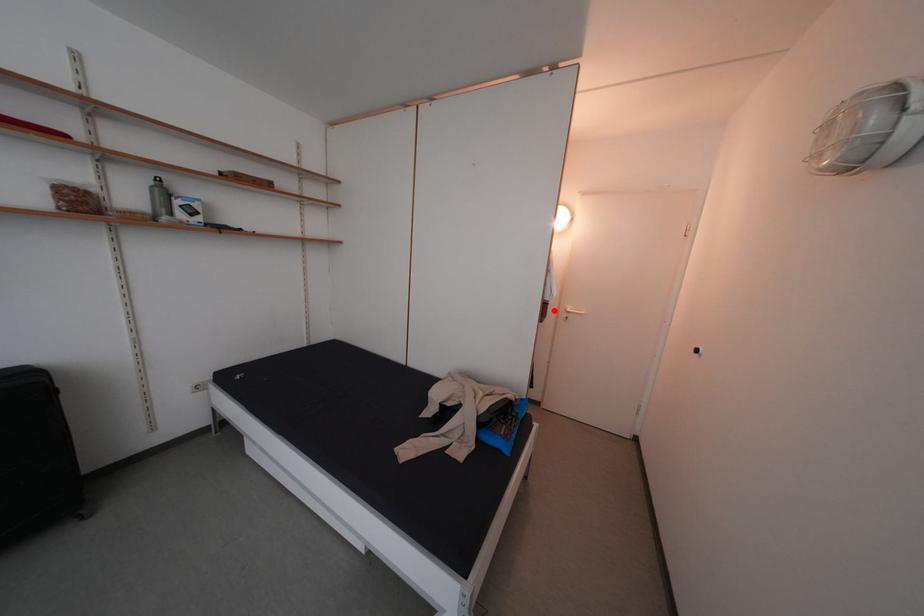
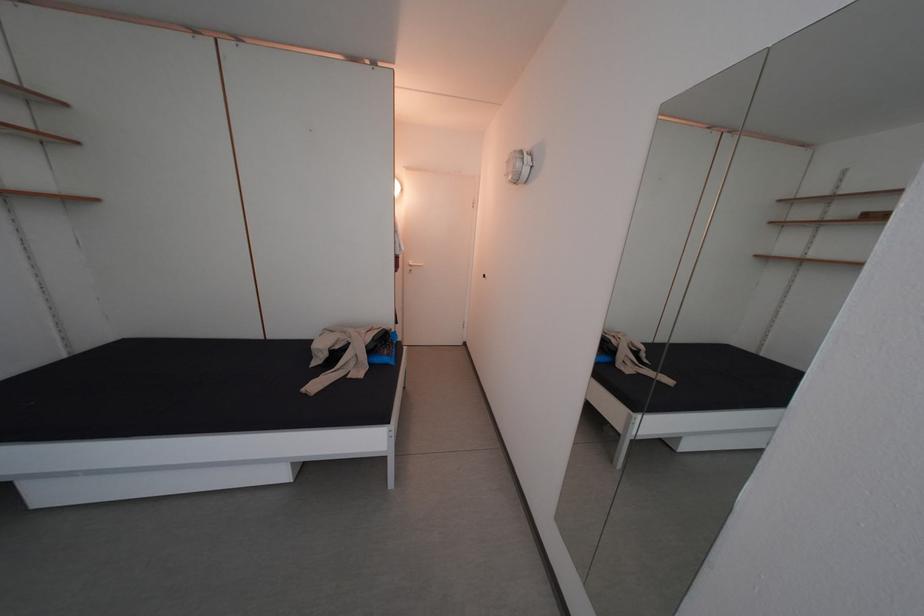
The point at the highlighted location is marked in the first image. Where is the corresponding point in the second image?

(407, 264)